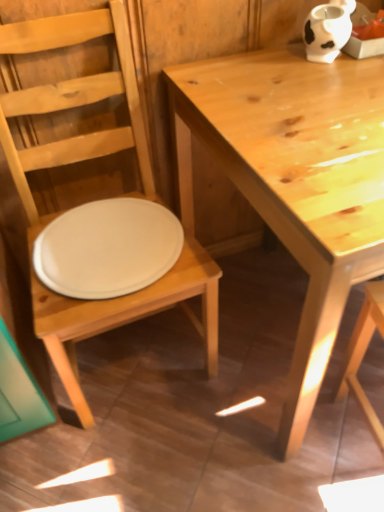
Image resolution: width=384 pixels, height=512 pixels. I want to click on free space below matte white plate at left (from a real-world perspective), so click(x=140, y=351).